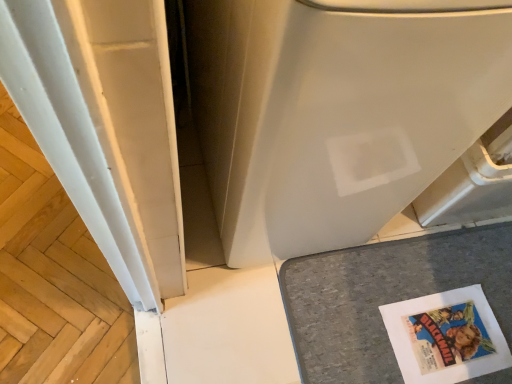
Question: Is gray felt mat at lower right wider than white matte water heater at center?

Choices:
 (A) no
 (B) yes

Answer: (A)

Question: Does gray felt mat at lower right lie in front of white matte water heater at center?

Choices:
 (A) no
 (B) yes

Answer: (A)

Question: From a real-world perspective, is gray felt mat at lower right under white matte water heater at center?

Choices:
 (A) no
 (B) yes

Answer: (B)

Question: Is gray felt mat at lower right positioned with its back to white matte water heater at center?

Choices:
 (A) no
 (B) yes

Answer: (B)

Question: From the image's perspective, does gray felt mat at lower right appear lower than white matte water heater at center?

Choices:
 (A) no
 (B) yes

Answer: (B)

Question: Does gray felt mat at lower right have a larger size compared to white matte water heater at center?

Choices:
 (A) no
 (B) yes

Answer: (A)

Question: Does white matte water heater at center come in front of white smooth wood at left?

Choices:
 (A) no
 (B) yes

Answer: (B)

Question: Can you confirm if white matte water heater at center is thinner than white smooth wood at left?

Choices:
 (A) yes
 (B) no

Answer: (B)

Question: Can white smooth wood at left be found inside white matte water heater at center?

Choices:
 (A) no
 (B) yes

Answer: (A)

Question: Is white smooth wood at left at the back of white matte water heater at center?

Choices:
 (A) no
 (B) yes

Answer: (A)

Question: From a real-world perspective, is white matte water heater at center located higher than white smooth wood at left?

Choices:
 (A) yes
 (B) no

Answer: (A)

Question: Does white matte water heater at center appear on the left side of white smooth wood at left?

Choices:
 (A) yes
 (B) no

Answer: (B)

Question: Can you confirm if white matte water heater at center is thinner than gray felt mat at lower right?

Choices:
 (A) no
 (B) yes

Answer: (A)